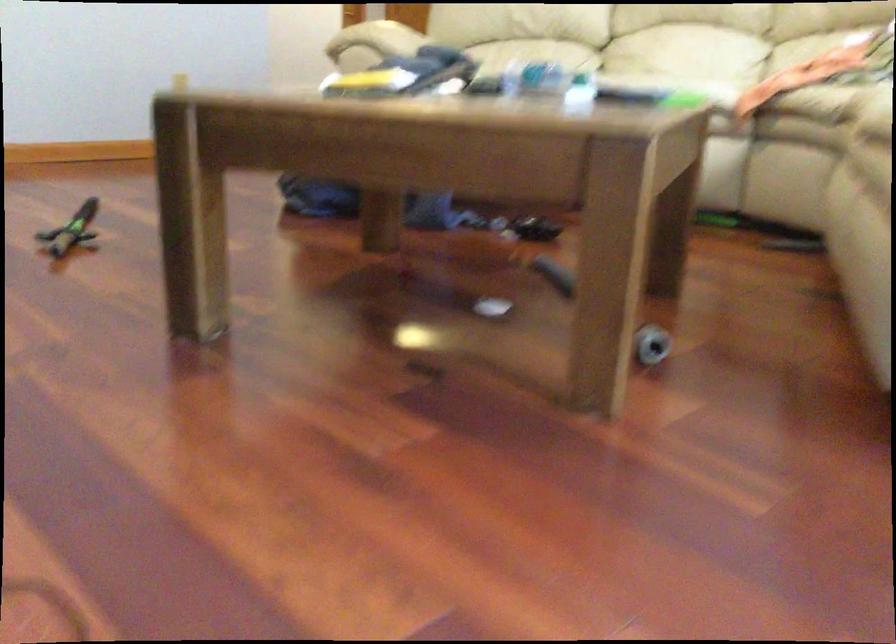
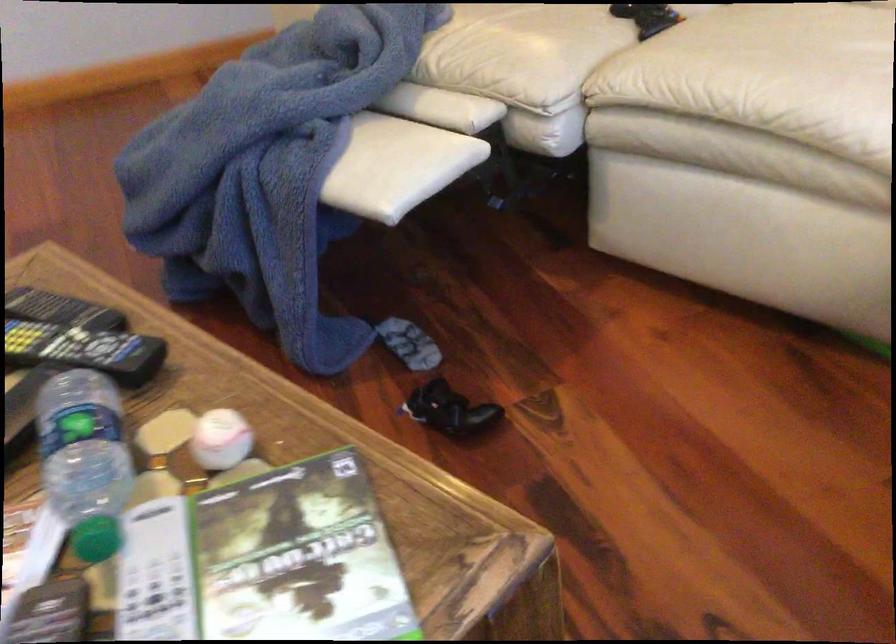
Find the pixel in the second image that matches pixel 583 82 in the first image.

(220, 439)